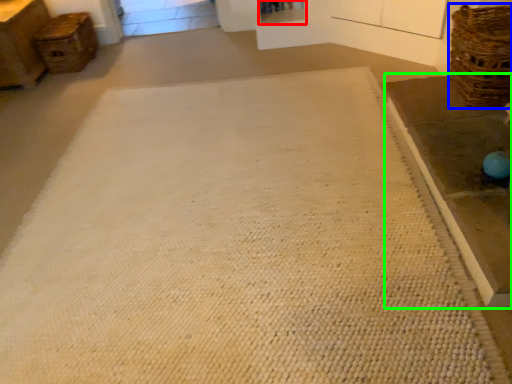
Question: Which is nearer to the shelf (highlighted by a red box)? basket (highlighted by a blue box) or table (highlighted by a green box).

Choices:
 (A) basket
 (B) table

Answer: (A)